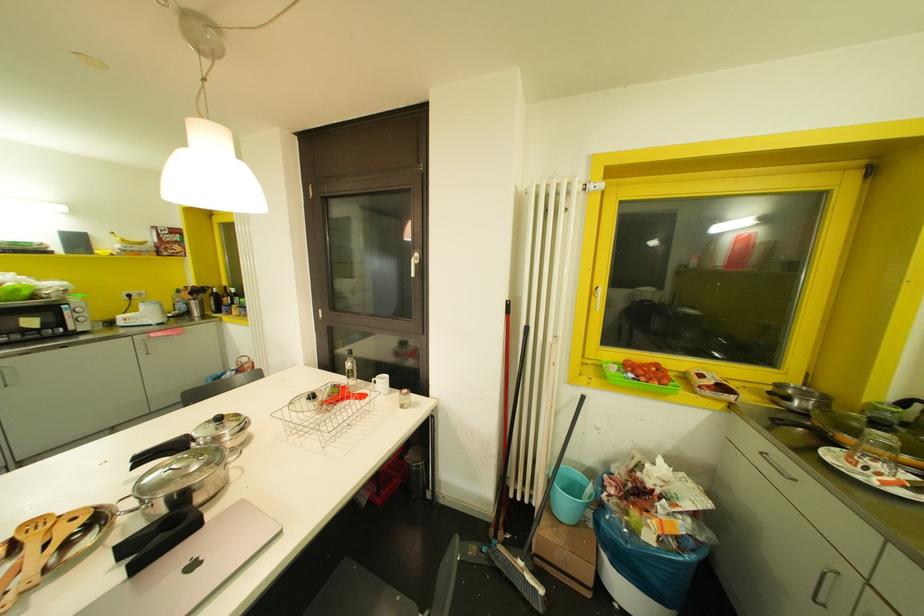
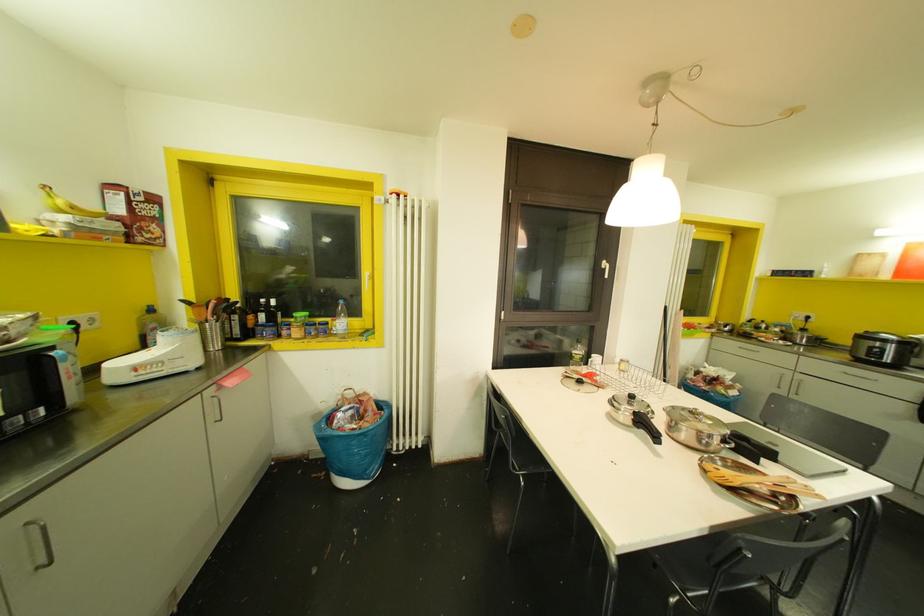
The point at (119, 322) is marked in the first image. Where is the corresponding point in the second image?

(116, 378)